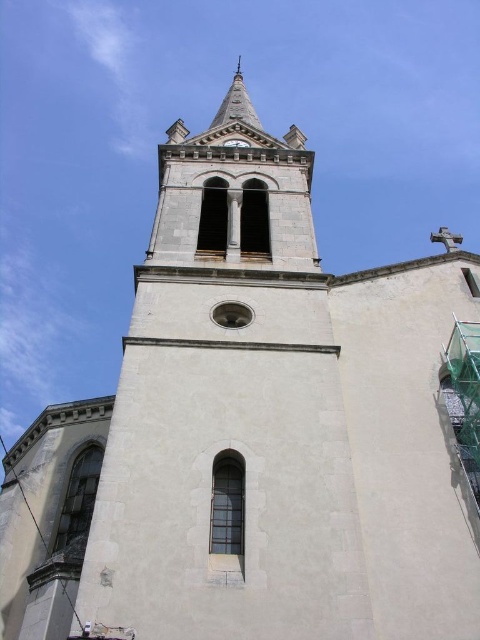
Is white stone spire at upper center to the right of dark brown wooden clock at center from the viewer's perspective?

Incorrect, white stone spire at upper center is not on the right side of dark brown wooden clock at center.

The height and width of the screenshot is (640, 480). What do you see at coordinates (236, 104) in the screenshot? I see `white stone spire at upper center` at bounding box center [236, 104].

Where is `white stone spire at upper center`? white stone spire at upper center is located at coordinates (236, 104).